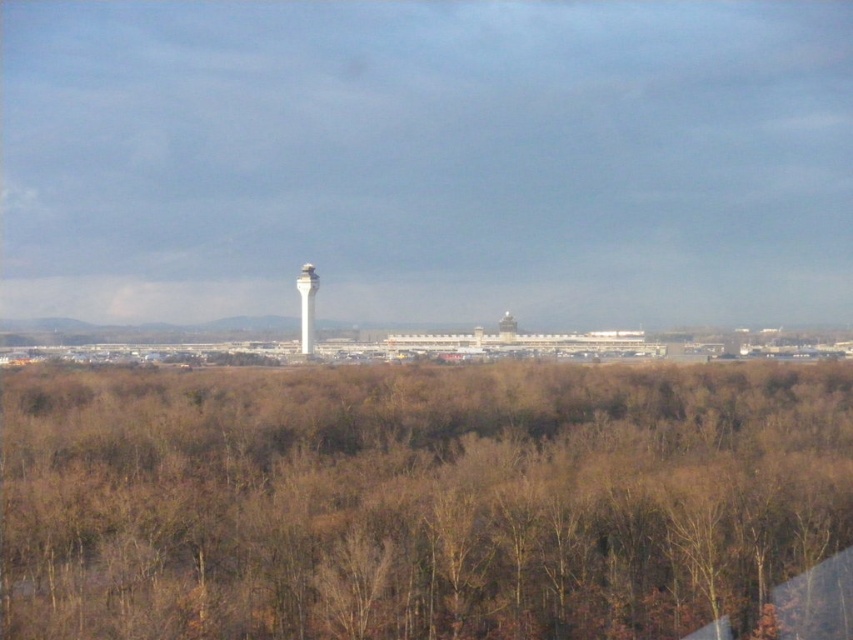
You are a drone operator flying a drone that needs to navigate between the brown leafless trees at center and the white smooth tower at center. Which object is closer to you as you fly over the scene?

The brown leafless trees at center are closer to the viewer than the white smooth tower at center, so the drone would first encounter the brown leafless trees at center before reaching the white smooth tower at center.

You are a pilot preparing for takeoff and need to ensure there are no obstructions in your flight path. You observe the brown leafless trees at center and the white smooth tower at center from the cockpit. Which object is taller and could potentially interfere with your flight path?

The brown leafless trees at center are much taller than the white smooth tower at center, so they could potentially interfere with the flight path.